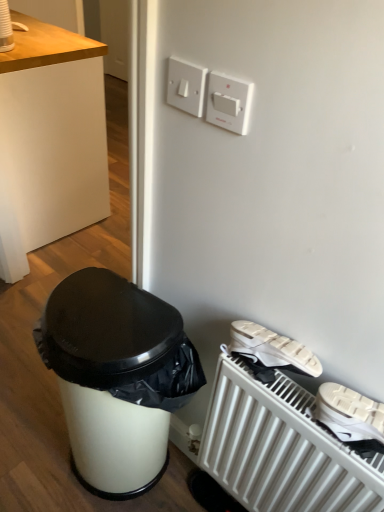
Question: Is white wood desk at upper left to the left or to the right of white plastic light switch at upper center in the image?

Choices:
 (A) left
 (B) right

Answer: (A)

Question: Is white wood desk at upper left bigger or smaller than white plastic light switch at upper center?

Choices:
 (A) small
 (B) big

Answer: (B)

Question: Estimate the real-world distances between objects in this image. Which object is farther from the white plastic light switch at upper center?

Choices:
 (A) white wood desk at upper left
 (B) white glossy trash can at lower left
 (C) white plastic switch at upper center
 (D) white matte radiator at lower right

Answer: (A)

Question: Estimate the real-world distances between objects in this image. Which object is closer to the white plastic light switch at upper center?

Choices:
 (A) white glossy trash can at lower left
 (B) white wood desk at upper left
 (C) white matte radiator at lower right
 (D) white plastic switch at upper center

Answer: (D)